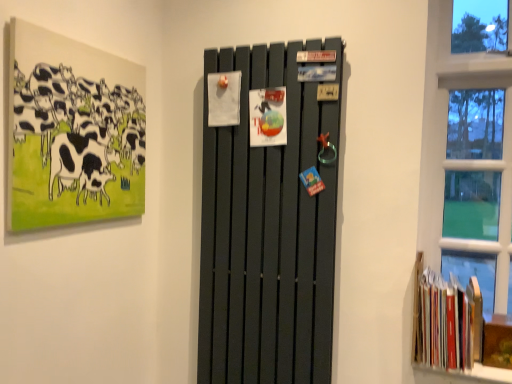
Question: Can you confirm if matte black painting of cows at upper left is smaller than hardcover books at lower right?

Choices:
 (A) yes
 (B) no

Answer: (A)

Question: Does matte black painting of cows at upper left touch hardcover books at lower right?

Choices:
 (A) no
 (B) yes

Answer: (A)

Question: Does matte black painting of cows at upper left appear on the right side of hardcover books at lower right?

Choices:
 (A) yes
 (B) no

Answer: (B)

Question: Are matte black painting of cows at upper left and hardcover books at lower right located far from each other?

Choices:
 (A) yes
 (B) no

Answer: (A)

Question: Does matte black painting of cows at upper left have a lesser width compared to hardcover books at lower right?

Choices:
 (A) no
 (B) yes

Answer: (B)

Question: Is matte black radiator at center to the left or to the right of matte black painting of cows at upper left in the image?

Choices:
 (A) right
 (B) left

Answer: (A)

Question: In terms of height, does matte black radiator at center look taller or shorter compared to matte black painting of cows at upper left?

Choices:
 (A) tall
 (B) short

Answer: (A)

Question: Considering the positions of matte black radiator at center and matte black painting of cows at upper left in the image, is matte black radiator at center wider or thinner than matte black painting of cows at upper left?

Choices:
 (A) wide
 (B) thin

Answer: (A)

Question: Choose the correct answer: Is matte black radiator at center inside matte black painting of cows at upper left or outside it?

Choices:
 (A) outside
 (B) inside

Answer: (A)

Question: In the image, is matte black radiator at center positioned in front of or behind hardcover books at lower right?

Choices:
 (A) behind
 (B) front

Answer: (B)

Question: In terms of width, does matte black radiator at center look wider or thinner when compared to hardcover books at lower right?

Choices:
 (A) thin
 (B) wide

Answer: (A)

Question: Is point pos(321,124) positioned closer to the camera than point pos(443,319)?

Choices:
 (A) farther
 (B) closer

Answer: (A)

Question: Considering the positions of matte black radiator at center and hardcover books at lower right in the image, is matte black radiator at center taller or shorter than hardcover books at lower right?

Choices:
 (A) tall
 (B) short

Answer: (A)

Question: Considering their positions, is hardcover books at lower right located in front of or behind matte black radiator at center?

Choices:
 (A) behind
 (B) front

Answer: (A)

Question: Which is correct: hardcover books at lower right is inside matte black radiator at center, or outside of it?

Choices:
 (A) inside
 (B) outside

Answer: (B)